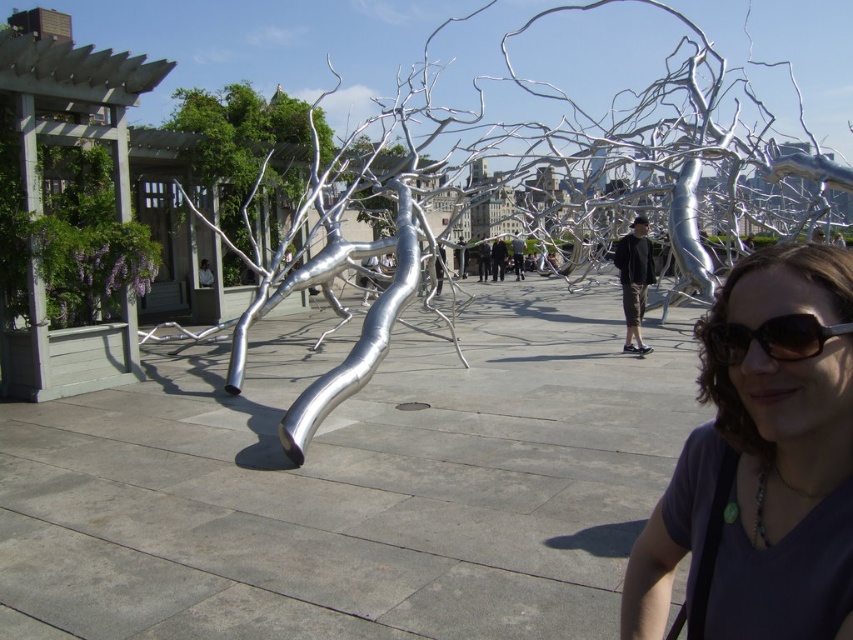
You are standing in the urban park and want to take a photo of both the silver metallic sculpture at center and the brushed metal tree at upper left. Which one should you position to your left side in the frame to capture both in the same photo?

You should position the brushed metal tree at upper left to your left side in the frame because the silver metallic sculpture at center is to the right of the brushed metal tree at upper left, so arranging them this way will ensure both are included in the photo.

You are standing at the entrance of the outdoor urban setting and see the point marked as point (761, 464). Can you determine if this point is closer to the wooden pergola with greenery and purple flowers or to the metallic silver sculptures?

The point (761, 464) is the matte black shirt at lower right, which is closer to the metallic silver sculptures than the wooden pergola with greenery and purple flowers.